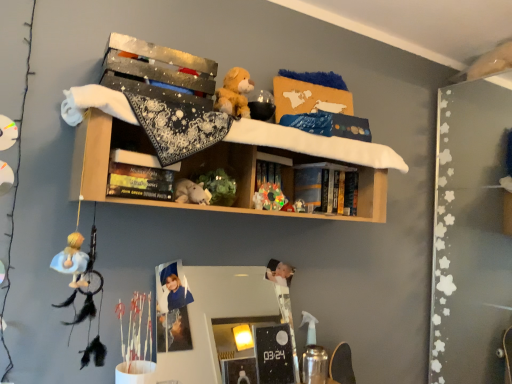
Question: Considering the relative sizes of blue hardcover book at center, acting as the second book starting from the front, and white plush toy at center, the 1th toy when ordered from left to right, in the image provided, is blue hardcover book at center, acting as the second book starting from the front, thinner than white plush toy at center, the 1th toy when ordered from left to right,?

Choices:
 (A) no
 (B) yes

Answer: (B)

Question: Can you confirm if blue hardcover book at center, marked as the 1th book in a right-to-left arrangement, is taller than white plush toy at center, the third toy in the right-to-left sequence?

Choices:
 (A) yes
 (B) no

Answer: (A)

Question: From a real-world perspective, is blue hardcover book at center, which is counted as the 1th book, starting from the back, beneath white plush toy at center, the 1th toy when ordered from left to right?

Choices:
 (A) no
 (B) yes

Answer: (A)

Question: Is blue hardcover book at center, marked as the 1th book in a right-to-left arrangement, positioned with its back to white plush toy at center, the third toy in the right-to-left sequence?

Choices:
 (A) no
 (B) yes

Answer: (A)

Question: Can you confirm if blue hardcover book at center, acting as the second book starting from the front, is wider than white plush toy at center, the third toy in the right-to-left sequence?

Choices:
 (A) no
 (B) yes

Answer: (A)

Question: Is blue hardcover book at center, acting as the 2th book starting from the left, at the left side of white plush toy at center, the third toy in the right-to-left sequence?

Choices:
 (A) no
 (B) yes

Answer: (A)

Question: Is white plush toy at center, the third toy in the right-to-left sequence, to the left of white plush toy at center, which appears as the 2th toy when viewed from the left, from the viewer's perspective?

Choices:
 (A) no
 (B) yes

Answer: (B)

Question: Does white plush toy at center, the third toy in the right-to-left sequence, have a larger size compared to white plush toy at center, the second toy viewed from the right?

Choices:
 (A) no
 (B) yes

Answer: (B)

Question: From the image's perspective, is white plush toy at center, the third toy in the right-to-left sequence, above white plush toy at center, which appears as the 2th toy when viewed from the left?

Choices:
 (A) no
 (B) yes

Answer: (B)

Question: Is white plush toy at center, the third toy in the right-to-left sequence, completely or partially outside of white plush toy at center, which appears as the 2th toy when viewed from the left?

Choices:
 (A) no
 (B) yes

Answer: (B)

Question: Does white plush toy at center, the 1th toy when ordered from left to right, have a greater width compared to white plush toy at center, which appears as the 2th toy when viewed from the left?

Choices:
 (A) no
 (B) yes

Answer: (B)

Question: Can you confirm if white plush toy at center, the third toy in the right-to-left sequence, is taller than white plush toy at center, the second toy viewed from the right?

Choices:
 (A) yes
 (B) no

Answer: (A)

Question: Is white plush toy at center, the 1th toy when ordered from left to right, in contact with blue hardcover book at center, acting as the second book starting from the front?

Choices:
 (A) yes
 (B) no

Answer: (B)